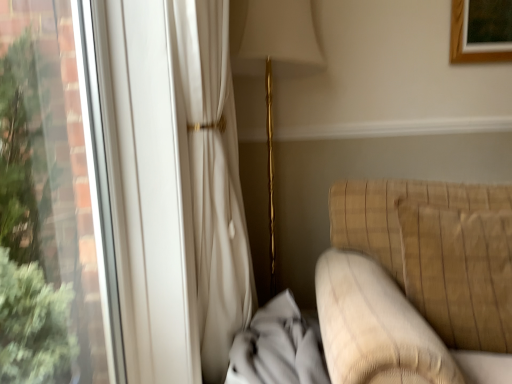
The image size is (512, 384). Find the location of `plaid fabric throw pillow at right`. plaid fabric throw pillow at right is located at coordinates (459, 272).

What do you see at coordinates (459, 272) in the screenshot? The height and width of the screenshot is (384, 512). I see `plaid fabric throw pillow at right` at bounding box center [459, 272].

Locate an element on the screen. plaid fabric throw pillow at right is located at coordinates (459, 272).